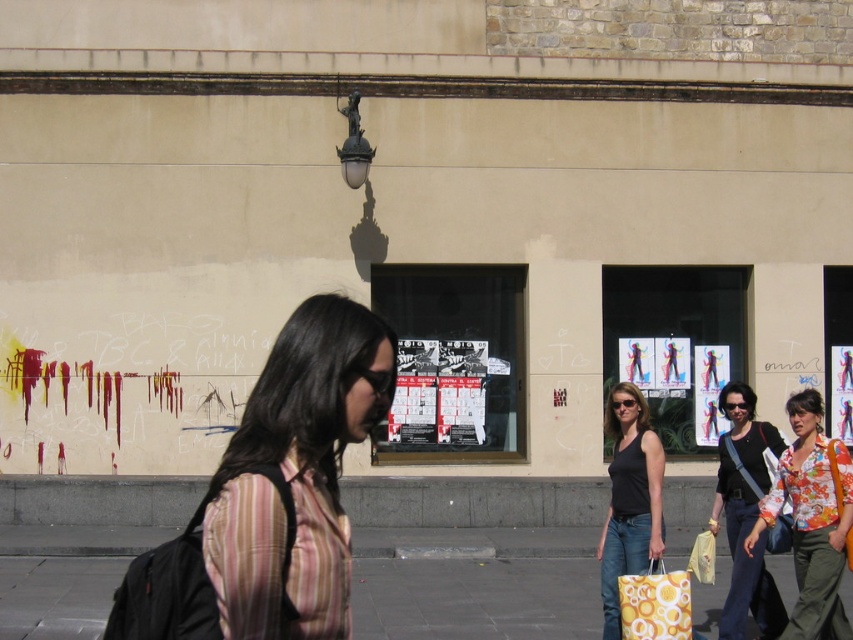
You are standing at the entrance of the beige building with a stone facade at the top and want to walk to the smooth concrete pavement at lower center. Which direction should you head?

The smooth concrete pavement at lower center is located at point (474, 598), so you should head towards the lower center direction to reach it.